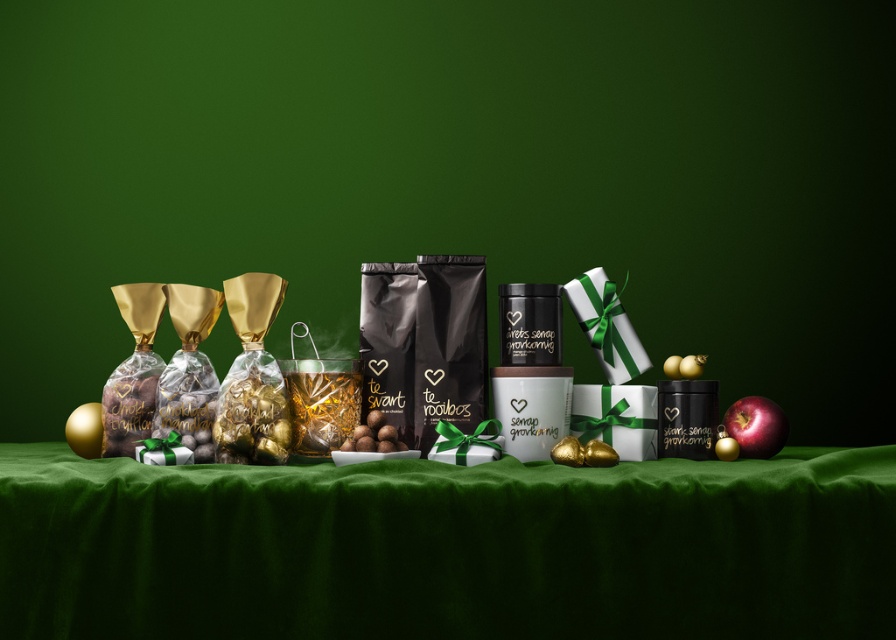
Does green velvet tablecloth at center appear on the right side of red glossy apple at right?

Incorrect, green velvet tablecloth at center is not on the right side of red glossy apple at right.

This screenshot has width=896, height=640. I want to click on green velvet tablecloth at center, so click(x=448, y=547).

This screenshot has width=896, height=640. I want to click on green velvet tablecloth at center, so click(448, 547).

Does green matte backdrop at center appear over green velvet tablecloth at center?

Correct, green matte backdrop at center is located above green velvet tablecloth at center.

Can you confirm if green matte backdrop at center is positioned to the left of green velvet tablecloth at center?

In fact, green matte backdrop at center is to the right of green velvet tablecloth at center.

Is point (557, 228) more distant than point (480, 465)?

Yes.

Where is `green matte backdrop at center`? Image resolution: width=896 pixels, height=640 pixels. green matte backdrop at center is located at coordinates (459, 177).

Does green matte backdrop at center appear on the left side of red glossy apple at right?

Indeed, green matte backdrop at center is positioned on the left side of red glossy apple at right.

Between green matte backdrop at center and red glossy apple at right, which one appears on the right side from the viewer's perspective?

Positioned to the right is red glossy apple at right.

The height and width of the screenshot is (640, 896). What do you see at coordinates (459, 177) in the screenshot?
I see `green matte backdrop at center` at bounding box center [459, 177].

Where is `green matte backdrop at center`? The image size is (896, 640). green matte backdrop at center is located at coordinates (459, 177).